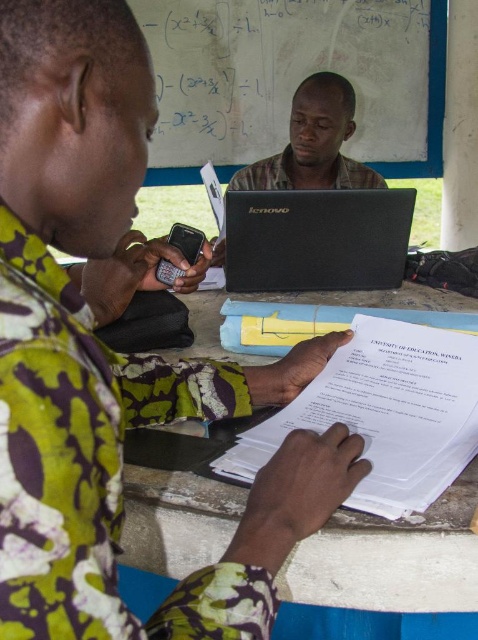
Question: Which point appears farthest from the camera in this image?

Choices:
 (A) (370, 168)
 (B) (465, 481)
 (C) (194, 256)

Answer: (A)

Question: Is blue wood table at center positioned behind black matte laptop at center?

Choices:
 (A) no
 (B) yes

Answer: (A)

Question: Which of the following is the farthest from the observer?

Choices:
 (A) (280, 596)
 (B) (373, 428)
 (C) (253, 118)
 (D) (300, 88)

Answer: (C)

Question: Is blue wood table at center wider than black matte phone at left?

Choices:
 (A) yes
 (B) no

Answer: (A)

Question: Is the position of white matte whiteboard at upper center less distant than that of matte black laptop at center?

Choices:
 (A) yes
 (B) no

Answer: (B)

Question: Among these points, which one is nearest to the camera?

Choices:
 (A) (162, 436)
 (B) (195, 244)
 (C) (389, 394)
 (D) (305, 140)

Answer: (A)